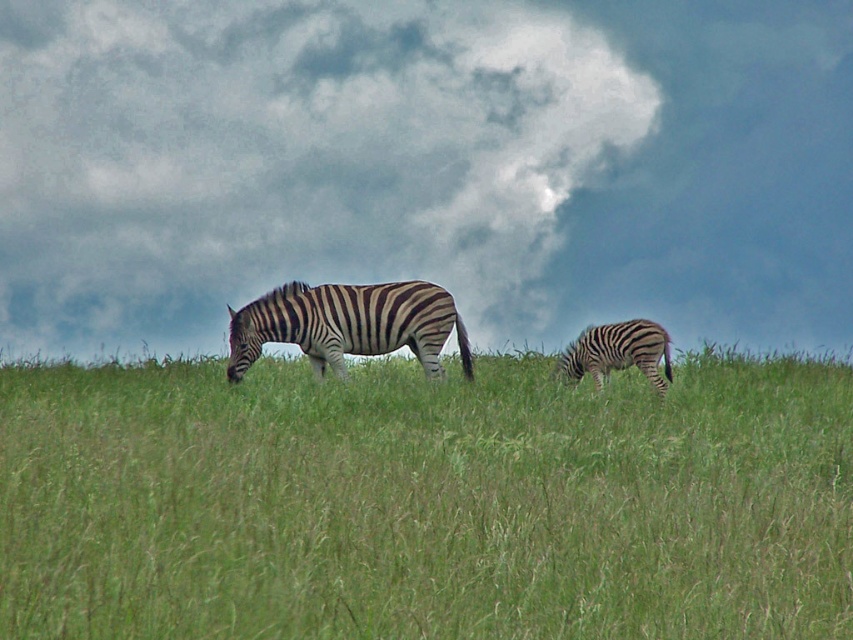
Question: Is black and white striped zebra at center positioned at the back of black and white striped zebra at lower right?

Choices:
 (A) yes
 (B) no

Answer: (A)

Question: Can you confirm if black and white striped zebra at center is wider than black and white striped zebra at lower right?

Choices:
 (A) no
 (B) yes

Answer: (B)

Question: Which point appears farthest from the camera in this image?

Choices:
 (A) (636, 339)
 (B) (444, 301)
 (C) (103, 150)

Answer: (C)

Question: Which object is the farthest from the green grass at center?

Choices:
 (A) cloudy sky at upper center
 (B) black and white striped zebra at center

Answer: (A)

Question: Does cloudy sky at upper center appear on the right side of black and white striped zebra at center?

Choices:
 (A) yes
 (B) no

Answer: (B)

Question: Among these points, which one is nearest to the camera?

Choices:
 (A) (140, 328)
 (B) (368, 449)
 (C) (590, 346)
 (D) (347, 312)

Answer: (B)